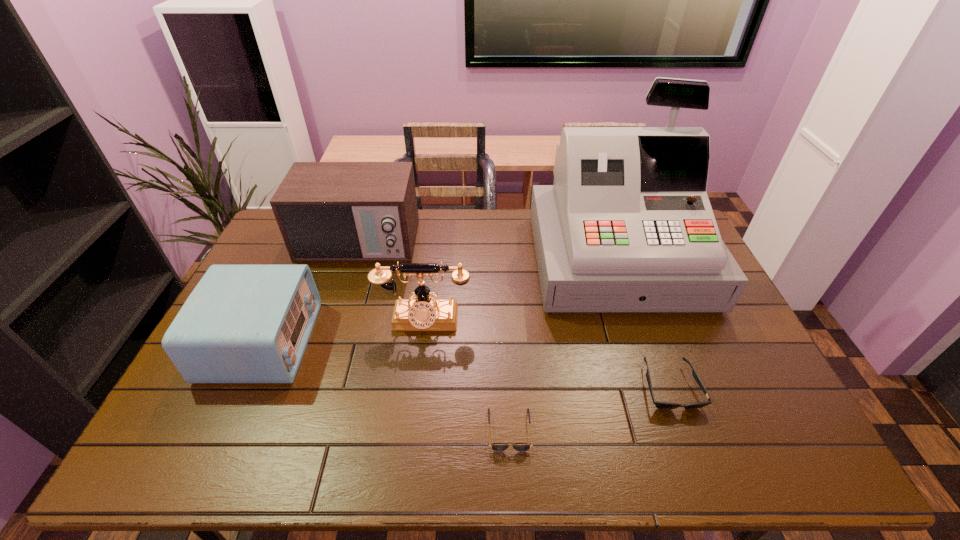
Locate an element on the screen. The width and height of the screenshot is (960, 540). vacant space at the far edge is located at coordinates (461, 218).

The width and height of the screenshot is (960, 540). I want to click on vacant region at the near edge, so click(x=420, y=451).

The image size is (960, 540). Identify the location of vacant region at the left edge of the desktop. (207, 386).

The image size is (960, 540). I want to click on free space at the right edge, so click(729, 334).

Locate an element on the screen. free space between the taller sunglasses and the cash register is located at coordinates (643, 323).

The height and width of the screenshot is (540, 960). In order to click on free spot between the left sunglasses and the cash register in this screenshot , I will do `click(563, 345)`.

Locate an element on the screen. free point between the fourth tallest object and the telephone is located at coordinates (343, 331).

You are a GUI agent. You are given a task and a screenshot of the screen. Output one action in this format:
    pyautogui.click(x=<x>, y=<y>)
    Task: Click on the free space between the taller radio receiver and the third object from right to left
    This screenshot has width=960, height=540.
    Given the screenshot: What is the action you would take?
    pyautogui.click(x=434, y=336)

You are a GUI agent. You are given a task and a screenshot of the screen. Output one action in this format:
    pyautogui.click(x=<x>, y=<y>)
    Task: Click on the free area in between the cash register and the taller sunglasses
    This screenshot has height=540, width=960.
    Given the screenshot: What is the action you would take?
    pyautogui.click(x=643, y=323)

In order to click on vacant area that lies between the tallest object and the right sunglasses in this screenshot , I will do `click(643, 323)`.